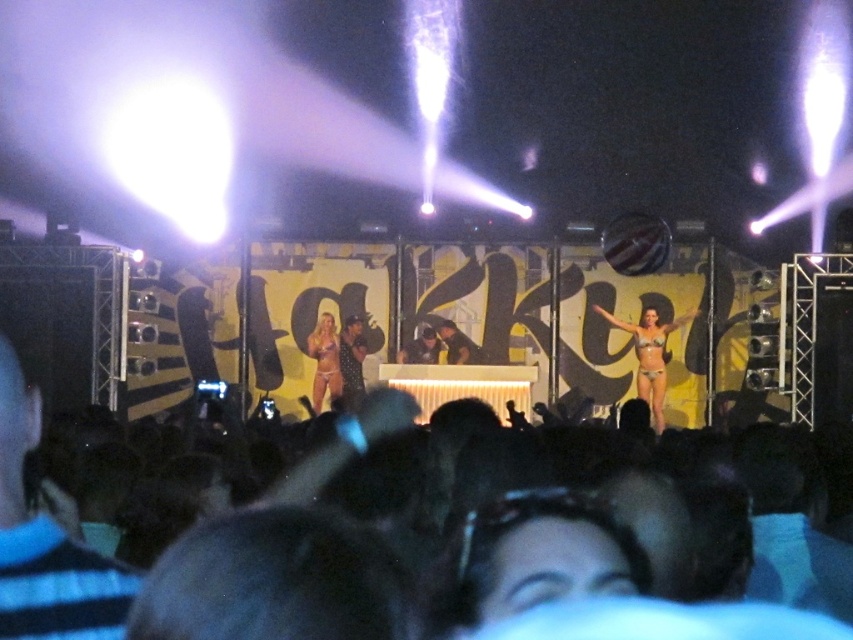
You are at a music event and see the black hair at lower center and the matte bikini at center. Which object takes up more space in the image?

The matte bikini at center takes up more space in the image than the black hair at lower center because the black hair at lower center is smaller than the matte bikini at center.

You are at the music event and want to take a photo of the performers. The black hair at lower center and the matte bikini at center are both in your viewfinder. Which performer is positioned to the left when looking at the scene?

The black hair at lower center is positioned to the left of the matte bikini at center.

You are a photographer at the event and want to capture a closeup of the matte black sunglasses at center and the matte bikini at center. If your camera can only focus on objects wider than 10 cm, will both items be in focus?

The matte black sunglasses at center is less than 10 cm wide since it is narrower than the matte bikini at center, which is wider than 10 cm. Therefore, the matte bikini at center will be in focus, but the matte black sunglasses at center may not be due to its smaller size.